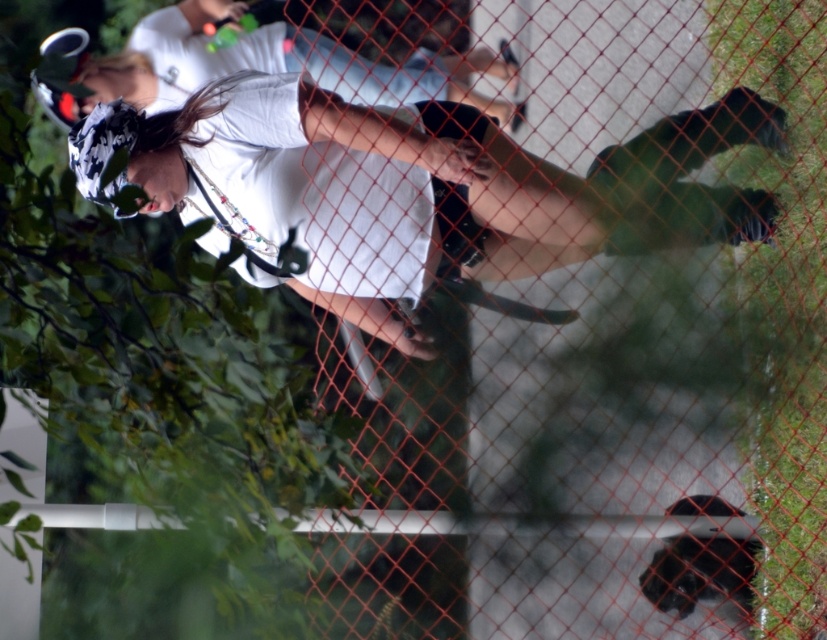
You are standing at the center of the image and want to pick up the white matte skateboard at center. Which direction should you move to reach it?

The white matte skateboard at center is already at the center of the image, so you don not need to move in any direction to reach it.

From the picture: You are a photographer trying to capture the person in the scene. Since the white matte skateboard at center and the white matte shirt at center are both in the frame, which object is taller and might block the view of the shirt?

The white matte skateboard at center is taller than the white matte shirt at center, so it might block the view of the shirt.